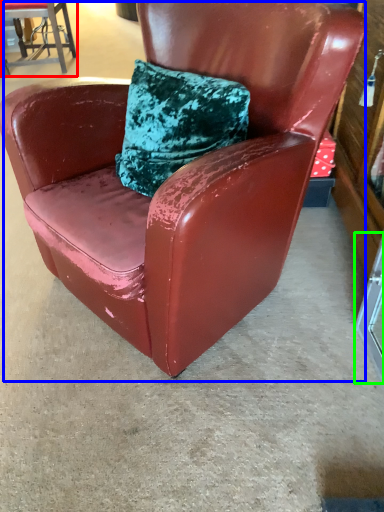
Question: Which object is the closest to the chair (highlighted by a red box)? Choose among these: chair (highlighted by a blue box) or glass door (highlighted by a green box).

Choices:
 (A) chair
 (B) glass door

Answer: (A)